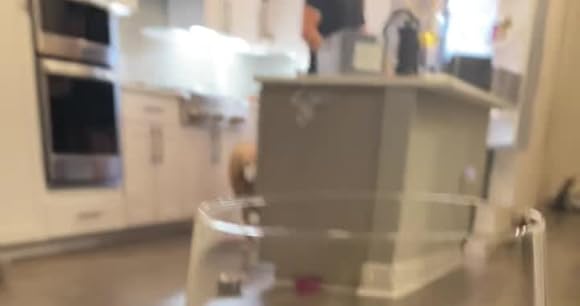
What are the coordinates of `floor` in the screenshot? It's located at pos(124,278).